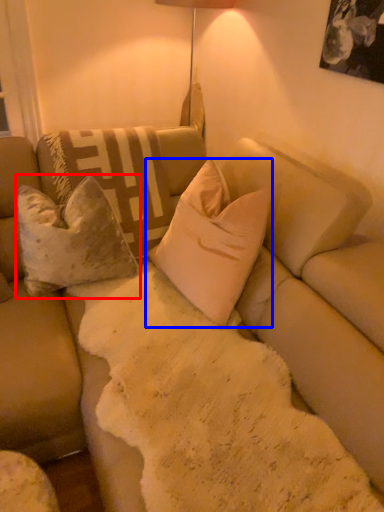
Question: Among these objects, which one is nearest to the camera, pillow (highlighted by a red box) or pillow (highlighted by a blue box)?

Choices:
 (A) pillow
 (B) pillow

Answer: (B)